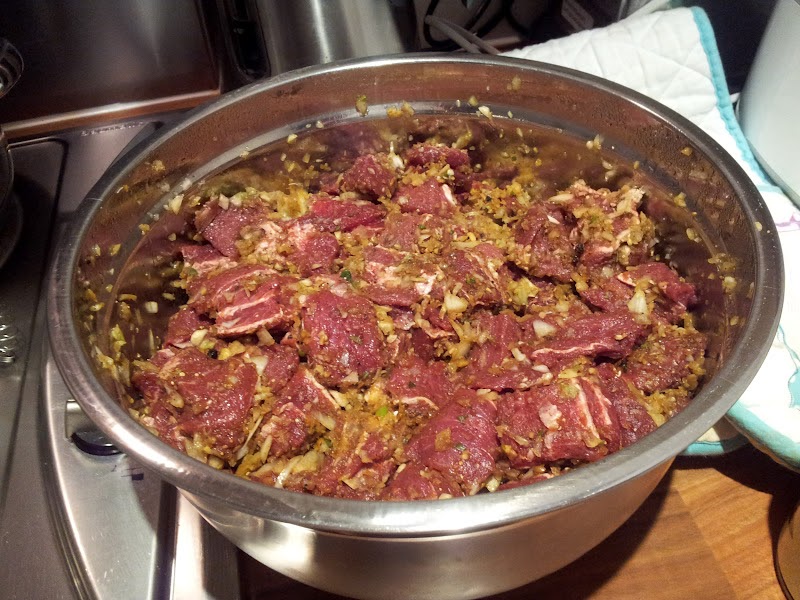
The width and height of the screenshot is (800, 600). Identify the location of brown wood surface. (637, 557).